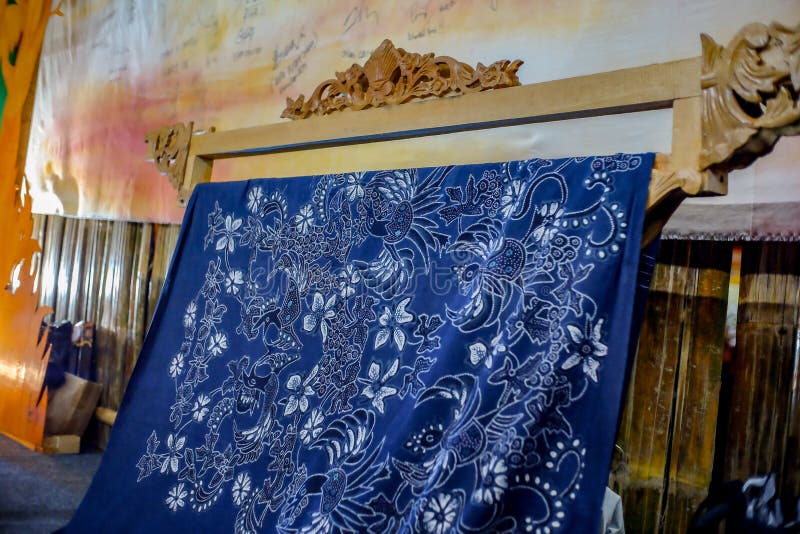
The width and height of the screenshot is (800, 534). Identify the location of box. (56, 400).